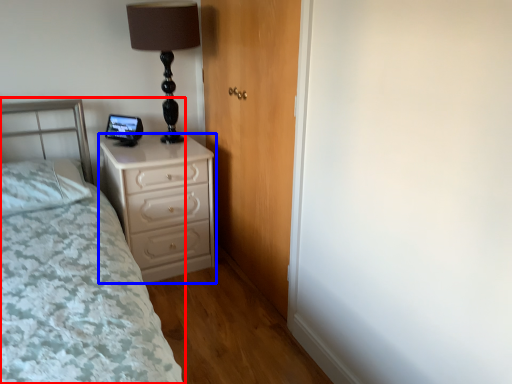
Question: Among these objects, which one is nearest to the camera, bed (highlighted by a red box) or chest of drawers (highlighted by a blue box)?

Choices:
 (A) bed
 (B) chest of drawers

Answer: (A)